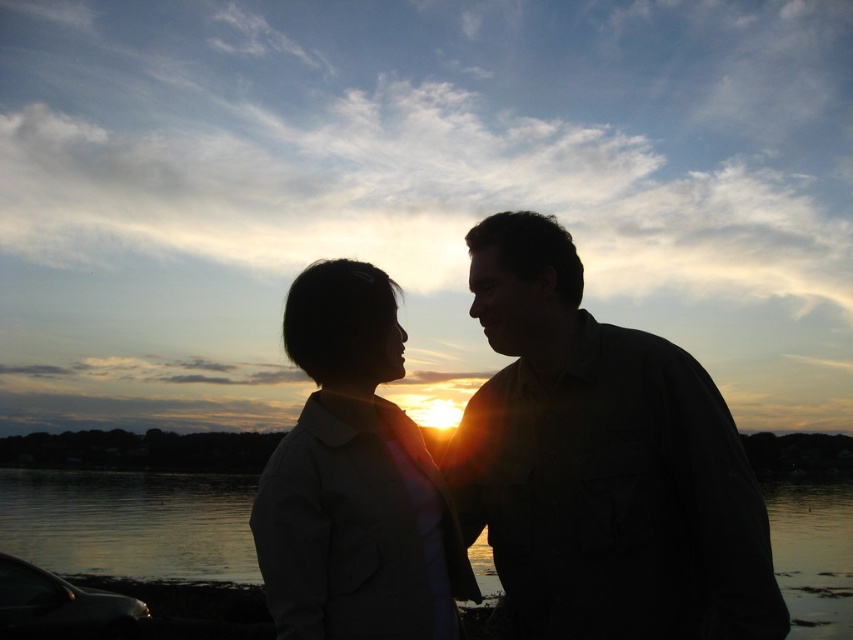
Question: Is silhouette couple at center to the right of glossy water at center from the viewer's perspective?

Choices:
 (A) no
 (B) yes

Answer: (A)

Question: Among these points, which one is farthest from the camera?

Choices:
 (A) (103, 497)
 (B) (492, 404)

Answer: (A)

Question: From the image, what is the correct spatial relationship of matte beige jacket at center in relation to glossy water at center?

Choices:
 (A) left
 (B) right

Answer: (A)

Question: Based on their relative distances, which object is nearer to the glossy water at center?

Choices:
 (A) silhouette couple at center
 (B) matte beige jacket at center

Answer: (A)

Question: Which object is positioned farthest from the glossy water at center?

Choices:
 (A) matte beige jacket at center
 (B) silhouette couple at center

Answer: (A)

Question: Is silhouette couple at center behind glossy water at center?

Choices:
 (A) no
 (B) yes

Answer: (A)